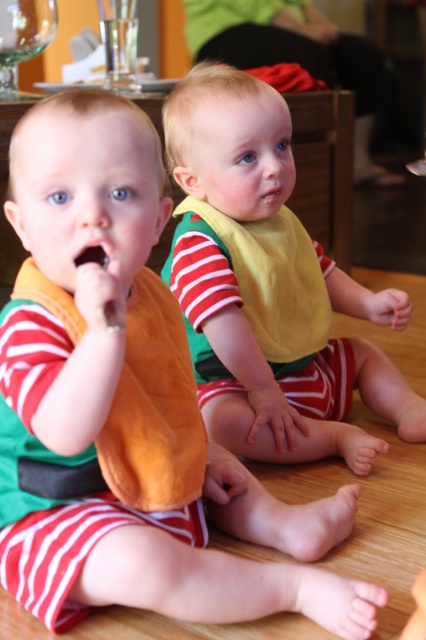
You are a photographer setting up a shoot in the scene described. You need to place a small prop exactly halfway between the yellow fabric bib at center and the transparent glass at upper left. Where should you position the prop?

The prop should be placed halfway between the yellow fabric bib at center and the transparent glass at upper left. Since the yellow fabric bib at center is to the right of the transparent glass at upper left, the midpoint would be along the line connecting their positions, closer to the transparent glass at upper left if the distance is uneven, but without exact measurements, the halfway point is the best estimate.

You are a parent standing in the room where the two children are sitting. You want to hand a toy to the child on the left wearing the orange bib. The toy is currently at point [181,291]. Can you reach the toy from your current position?

The distance between point [181,291] and the viewer is 1.32 meters. Since the parent is standing, they can likely reach the toy if they can extend their arm about 1.32 meters. However, typical adult arm length is around 0.7 meters, so the parent may need to take a step forward to reach the toy at point [181,291].

You are a photographer standing 4 feet away from the yellow fabric bib at center. Can you take a clear photo of it without moving closer?

The yellow fabric bib at center is 4.12 feet away from the camera. Since you are standing 4 feet away, you are close enough to take a clear photo without needing to move closer.